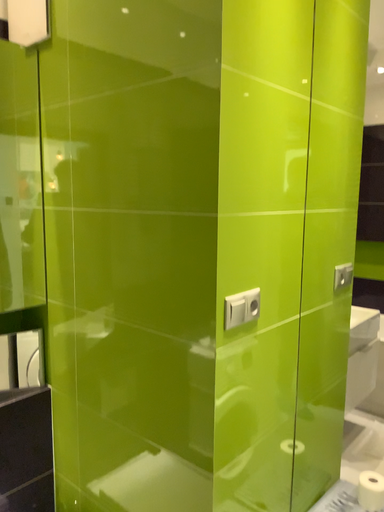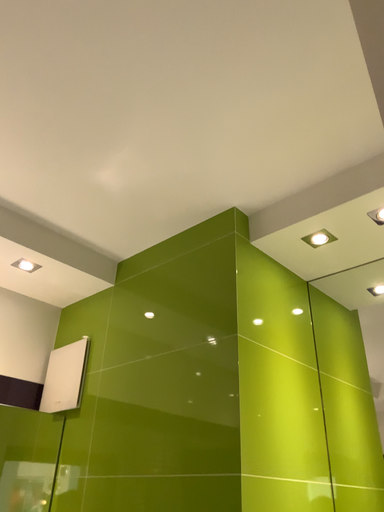
Question: How did the camera likely rotate when shooting the video?

Choices:
 (A) rotated downward
 (B) rotated upward

Answer: (B)